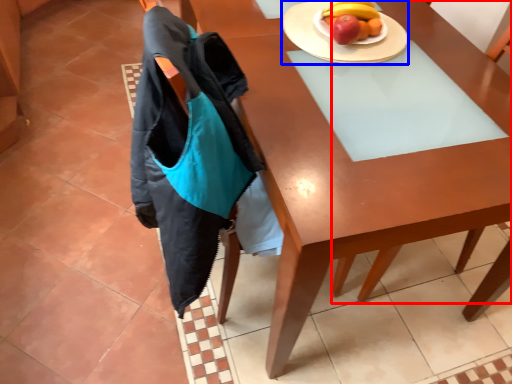
Question: Which of the following is the farthest to the observer, chair (highlighted by a red box) or plate (highlighted by a blue box)?

Choices:
 (A) chair
 (B) plate

Answer: (B)